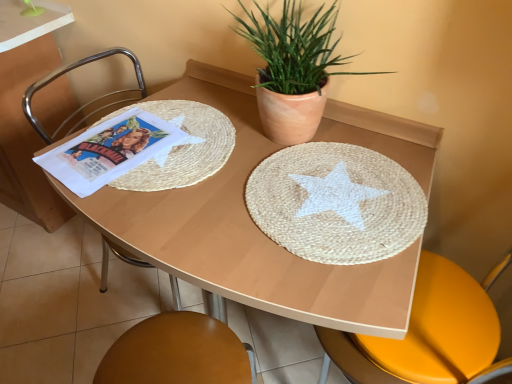
Image resolution: width=512 pixels, height=384 pixels. I want to click on free point above wooden table at center (from a real-world perspective), so click(207, 181).